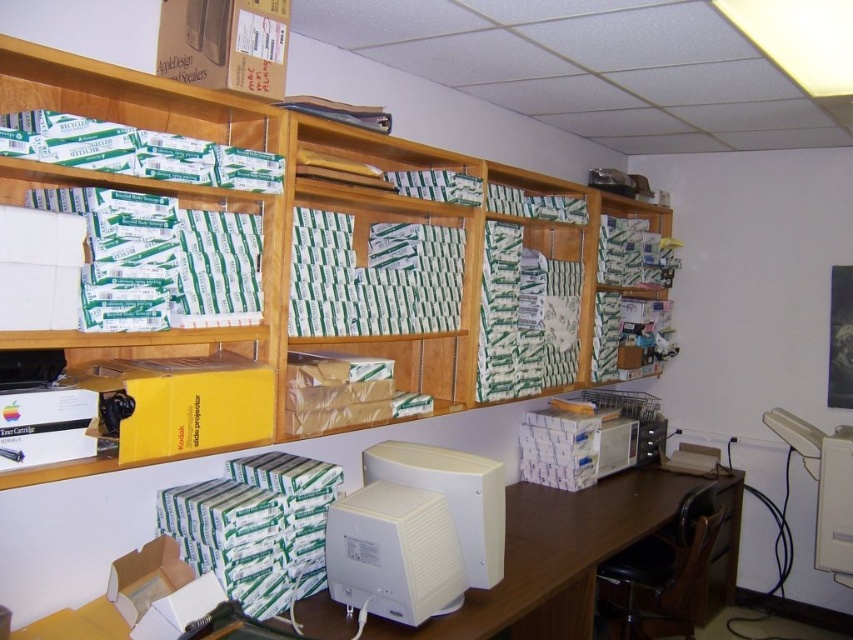
Based on the photo, can you confirm if cardboard box at upper left is shorter than white plastic printer at right?

Indeed, cardboard box at upper left has a lesser height compared to white plastic printer at right.

Can you confirm if cardboard box at upper left is taller than white plastic printer at right?

In fact, cardboard box at upper left may be shorter than white plastic printer at right.

Who is more forward, (175,3) or (846,518)?

Point (175,3)

Locate an element on the screen. cardboard box at upper left is located at coordinates (225, 44).

Is yellow cardboard projector at center positioned before white plastic monitor at center?

Yes, it is in front of white plastic monitor at center.

Is point (167, 365) farther from viewer compared to point (424, 582)?

No, (167, 365) is in front of (424, 582).

Which is in front, point (195, 365) or point (410, 612)?

Point (195, 365) is in front.

Locate an element on the screen. Image resolution: width=853 pixels, height=640 pixels. yellow cardboard projector at center is located at coordinates (178, 403).

Which is in front, point (120, 177) or point (451, 456)?

Point (120, 177) is more forward.

Can you confirm if wooden shelves at upper center is positioned above white matte computer monitor at center?

Yes, wooden shelves at upper center is above white matte computer monitor at center.

Find the location of `wooden shelves at upper center`. wooden shelves at upper center is located at coordinates (280, 224).